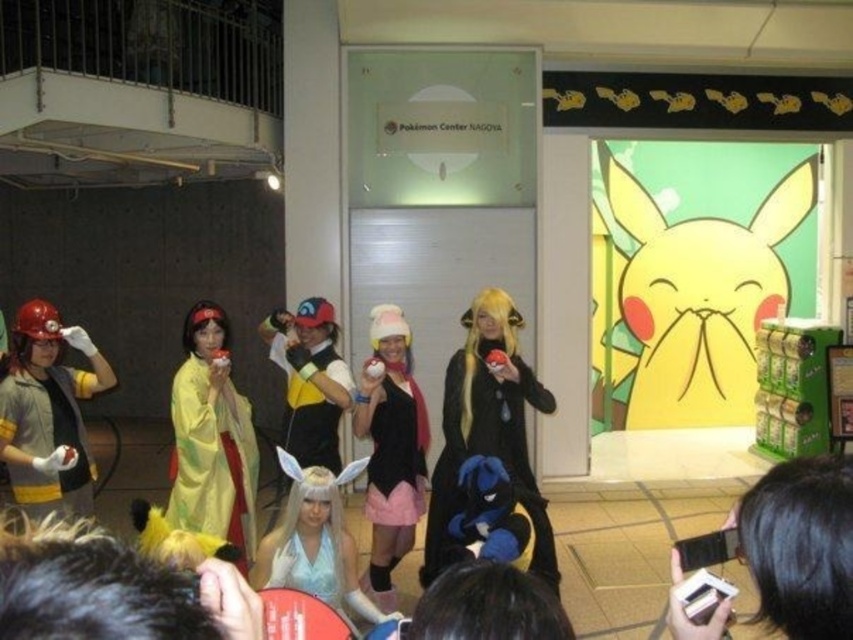
You are a photographer at the event and want to capture both the black velvet dress at center and the yellow fabric dress at center in a single photo. Which dress should you focus on first to ensure both are in frame?

The black velvet dress at center is located below the yellow fabric dress at center, so focus on the yellow fabric dress at center first to ensure both are in frame.